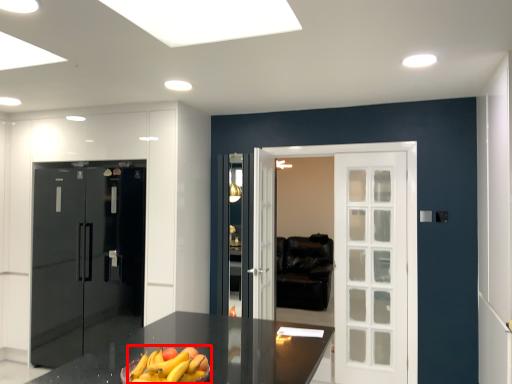
Question: From the image's perspective, what is the correct spatial relationship of banana (annotated by the red box) in relation to door?

Choices:
 (A) above
 (B) below

Answer: (A)